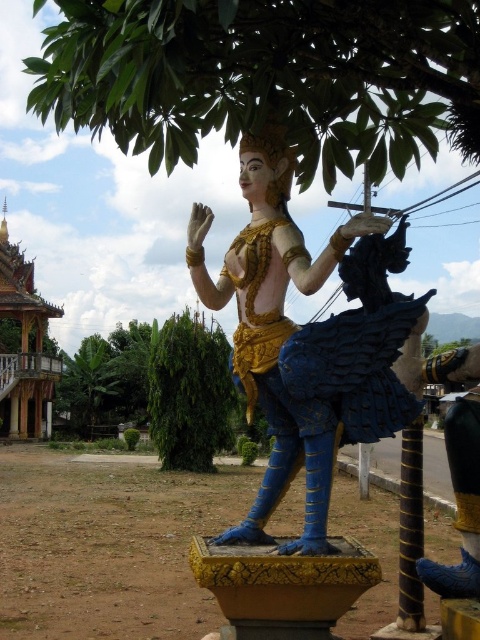
Can you confirm if green leafy tree at upper center is positioned to the right of green leafy tree at center?

Yes, green leafy tree at upper center is to the right of green leafy tree at center.

Is point (410, 45) positioned behind point (164, 392)?

No, (410, 45) is closer to viewer.

Identify the location of green leafy tree at upper center. This screenshot has width=480, height=640. (266, 76).

Does gold textured statue at center have a greater height compared to green leafy tree at center?

In fact, gold textured statue at center may be shorter than green leafy tree at center.

Between gold textured statue at center and green leafy tree at center, which one has more height?

Standing taller between the two is green leafy tree at center.

Looking at this image, who is more forward, (324, 442) or (170, 426)?

Positioned in front is point (324, 442).

Identify the location of gold textured statue at center. The width and height of the screenshot is (480, 640). (275, 330).

Consider the image. Does gold textured statue at center appear under green leafy tree at lower left?

Actually, gold textured statue at center is above green leafy tree at lower left.

Who is more distant from viewer, (297, 544) or (62, 388)?

The point (62, 388) is more distant.

Where is `gold textured statue at center`? This screenshot has width=480, height=640. gold textured statue at center is located at coordinates (275, 330).